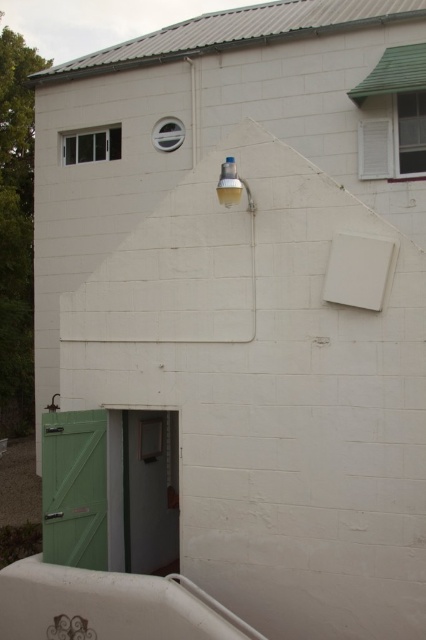
Question: Does green matte door at lower left appear over clear glass window at upper left?

Choices:
 (A) yes
 (B) no

Answer: (B)

Question: Which object appears closest to the camera in this image?

Choices:
 (A) white matte window at upper right
 (B) clear glass window at upper left

Answer: (A)

Question: Is green matte door at lower left behind white matte window at upper right?

Choices:
 (A) yes
 (B) no

Answer: (B)

Question: Does white matte window at upper right appear under clear glass window at upper left?

Choices:
 (A) yes
 (B) no

Answer: (A)

Question: Which point is closer to the camera taking this photo?

Choices:
 (A) (106, 141)
 (B) (94, 429)

Answer: (B)

Question: Which is nearer to the metallic circular vent at upper center?

Choices:
 (A) green matte door at lower left
 (B) clear glass window at upper left

Answer: (B)